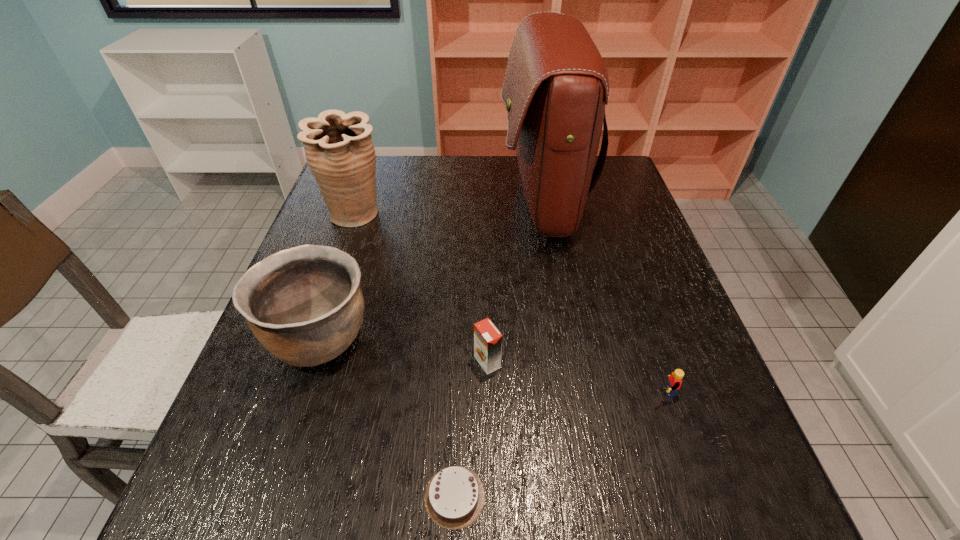
Identify the location of satchel. The height and width of the screenshot is (540, 960). (556, 85).

At what (x,y) coordinates should I click in order to perform the action: click on the fifth object from left to right. Please return your answer as a coordinate pair (x, y). Image resolution: width=960 pixels, height=540 pixels. Looking at the image, I should click on [556, 85].

What are the coordinates of `urn` in the screenshot? It's located at (339, 150).

Locate an element on the screen. This screenshot has height=540, width=960. pottery is located at coordinates (305, 305).

Find the location of `orange juice`. orange juice is located at coordinates (487, 339).

Identify the location of the rightmost object. The width and height of the screenshot is (960, 540). (674, 381).

At what (x,y) coordinates should I click in order to perform the action: click on chocolate cake. Please return your answer as a coordinate pair (x, y). This screenshot has width=960, height=540. Looking at the image, I should click on (454, 498).

Locate an element on the screen. The image size is (960, 540). the nearest object is located at coordinates (454, 498).

Where is `blank space located 0.360m on the open flap of the tallest object`? blank space located 0.360m on the open flap of the tallest object is located at coordinates (377, 201).

Identify the location of free space located 0.210m on the open flap of the tallest object. The height and width of the screenshot is (540, 960). (428, 201).